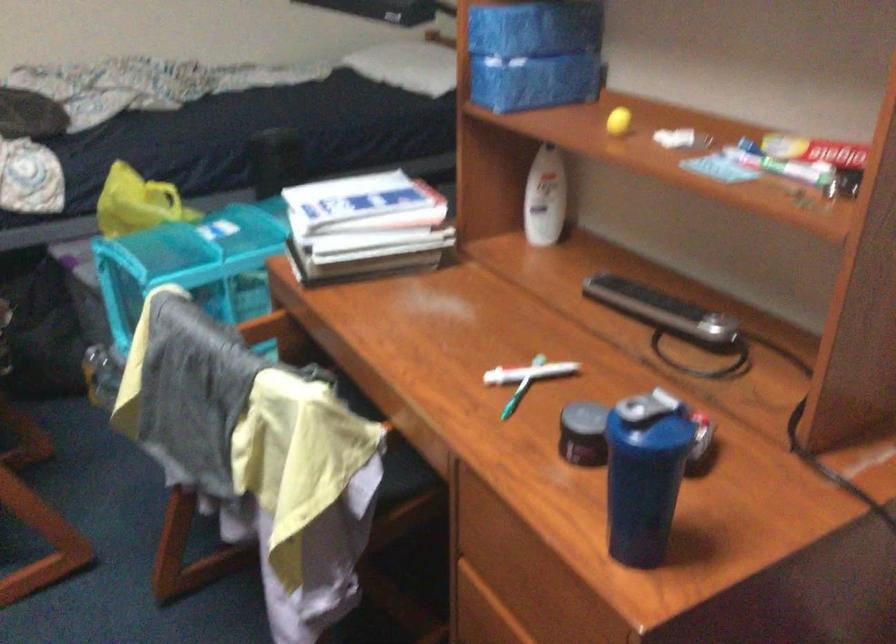
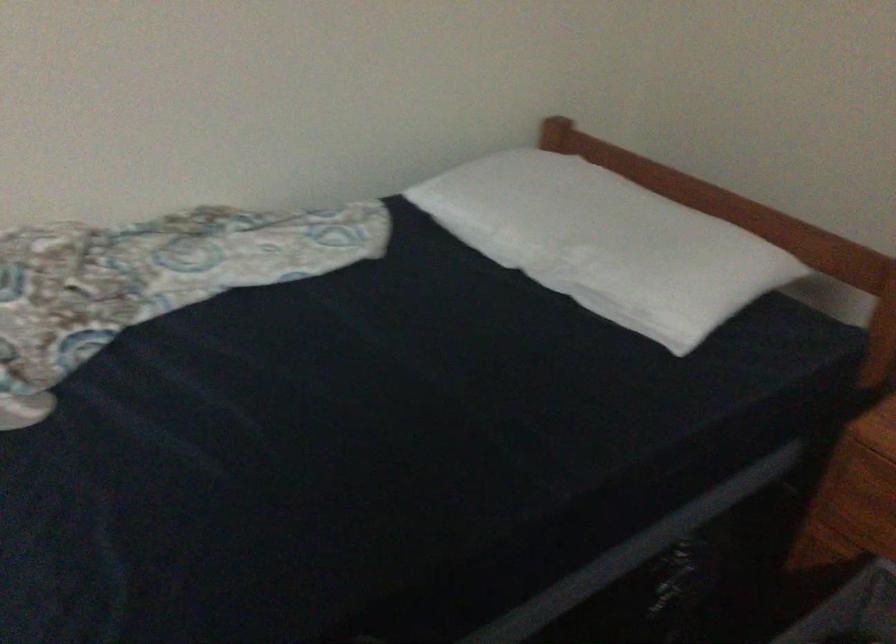
Question: In a continuous first-person perspective shot, in which direction is the camera moving?

Choices:
 (A) Left
 (B) Right
 (C) Forward
 (D) Backward

Answer: (C)